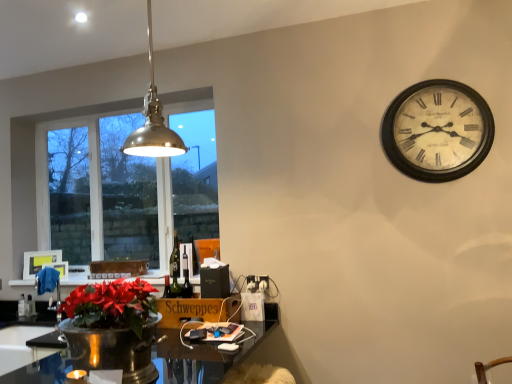
What do you see at coordinates (206, 354) in the screenshot?
I see `shiny black desk at lower center` at bounding box center [206, 354].

In order to face white plastic power outlet at lower center, should I rotate leftwards or rightwards?

Turn right by 0.113 degrees to look at white plastic power outlet at lower center.

What do you see at coordinates (47, 165) in the screenshot? I see `clear glass window at left` at bounding box center [47, 165].

You are a GUI agent. You are given a task and a screenshot of the screen. Output one action in this format:
    pyautogui.click(x=<x>, y=<y>)
    Task: Click on the matte white picture frame at left, the second picture frame in the right-to-left sequence
    
    Given the screenshot: What is the action you would take?
    coord(39,261)

Describe the element at coordinates (437, 131) in the screenshot. This screenshot has height=384, width=512. I see `white painted wood clock at upper right` at that location.

Find the location of `metallic pendant light at upper left`. metallic pendant light at upper left is located at coordinates (153, 120).

Describe the element at coordinates (153, 120) in the screenshot. I see `metallic pendant light at upper left` at that location.

In order to click on shiny black desk at lower center in this screenshot , I will do `click(206, 354)`.

Considering the sizes of objects white painted wood clock at upper right and matte white picture frame at left, placed as the 1th picture frame when sorted from left to right, in the image provided, who is taller, white painted wood clock at upper right or matte white picture frame at left, placed as the 1th picture frame when sorted from left to right,?

With more height is white painted wood clock at upper right.

Is point (389, 118) positioned before point (29, 266)?

Yes.

Which picture frame is the 2nd one when counting from the left side of the white painted wood clock at upper right? Please provide its 2D coordinates.

[(39, 261)]

Considering the relative sizes of white painted wood clock at upper right and matte white picture frame at left, placed as the 1th picture frame when sorted from left to right, in the image provided, is white painted wood clock at upper right smaller than matte white picture frame at left, placed as the 1th picture frame when sorted from left to right,?

Incorrect, white painted wood clock at upper right is not smaller in size than matte white picture frame at left, placed as the 1th picture frame when sorted from left to right.

From a real-world perspective, is shiny black desk at lower center physically located above or below matte white picture frame at left, the second picture frame in the right-to-left sequence?

From a real-world perspective, shiny black desk at lower center is physically below matte white picture frame at left, the second picture frame in the right-to-left sequence.

Is shiny black desk at lower center shorter than matte white picture frame at left, the second picture frame in the right-to-left sequence?

No, shiny black desk at lower center is not shorter than matte white picture frame at left, the second picture frame in the right-to-left sequence.

From the image's perspective, is shiny black desk at lower center under matte white picture frame at left, the second picture frame in the right-to-left sequence?

Correct, shiny black desk at lower center appears lower than matte white picture frame at left, the second picture frame in the right-to-left sequence, in the image.

Which is correct: wooden schweppes at lower center, which ranks as the second cardboard box in left-to-right order, is inside white plastic power outlet at lower center, or outside of it?

wooden schweppes at lower center, which ranks as the second cardboard box in left-to-right order, is spatially situated outside white plastic power outlet at lower center.

Is wooden schweppes at lower center, the 2th cardboard box from the top, wider than white plastic power outlet at lower center?

Yes.

Is wooden schweppes at lower center, arranged as the 1th cardboard box when ordered from the bottom, at the left side of white plastic power outlet at lower center?

Yes.

From the image's perspective, which one is positioned higher, wooden schweppes at lower center, which ranks as the second cardboard box in left-to-right order, or white plastic power outlet at lower center?

white plastic power outlet at lower center, from the image's perspective.

From the image's perspective, relative to clear glass window at left, is shiny black desk at lower center above or below?

Clearly, from the image's perspective, shiny black desk at lower center is below clear glass window at left.

Could you tell me if shiny black desk at lower center is turned towards clear glass window at left?

No, shiny black desk at lower center is not turned towards clear glass window at left.

From a real-world perspective, does shiny black desk at lower center stand above clear glass window at left?

No.

How many degrees apart are the facing directions of shiny black desk at lower center and clear glass window at left?

There is a 90-degree angle between the facing directions of shiny black desk at lower center and clear glass window at left.

Does clear glass window at left have a lesser width compared to brown cardboard box at lower center, the first cardboard box viewed from the left?

Yes.

Which object is more forward, clear glass window at left or brown cardboard box at lower center, which is the second cardboard box from right to left?

Positioned in front is clear glass window at left.

The height and width of the screenshot is (384, 512). Find the location of `window on the left of brown cardboard box at lower center, marked as the second cardboard box in a front-to-back arrangement`. window on the left of brown cardboard box at lower center, marked as the second cardboard box in a front-to-back arrangement is located at coordinates (47, 165).

From a real-world perspective, between clear glass window at left and brown cardboard box at lower center, the 2th cardboard box positioned from the bottom, who is vertically higher?

clear glass window at left is physically above.

Who is taller, metallic pendant light at upper left or matte white picture frame at upper left, positioned as the first picture frame in right-to-left order?

metallic pendant light at upper left is taller.

How much distance is there between metallic pendant light at upper left and matte white picture frame at upper left, positioned as the first picture frame in right-to-left order?

They are 1.60 meters apart.

Is metallic pendant light at upper left with matte white picture frame at upper left, placed as the 2th picture frame when sorted from left to right?

There is a gap between metallic pendant light at upper left and matte white picture frame at upper left, placed as the 2th picture frame when sorted from left to right.

Which point is more distant from viewer, (x=150, y=28) or (x=61, y=272)?

The point (x=61, y=272) is farther.

In the scene shown: Which object is thinner, wooden schweppes at lower center, the 2th cardboard box from the top, or matte white picture frame at left, the second picture frame in the right-to-left sequence?

matte white picture frame at left, the second picture frame in the right-to-left sequence.

From a real-world perspective, is wooden schweppes at lower center, arranged as the 1th cardboard box when ordered from the bottom, under matte white picture frame at left, the second picture frame in the right-to-left sequence?

Yes, from a real-world perspective, wooden schweppes at lower center, arranged as the 1th cardboard box when ordered from the bottom, is beneath matte white picture frame at left, the second picture frame in the right-to-left sequence.

Could you measure the distance between wooden schweppes at lower center, arranged as the 1th cardboard box when ordered from the bottom, and matte white picture frame at left, the second picture frame in the right-to-left sequence?

wooden schweppes at lower center, arranged as the 1th cardboard box when ordered from the bottom, is 1.46 meters from matte white picture frame at left, the second picture frame in the right-to-left sequence.

Would you say wooden schweppes at lower center, arranged as the 1th cardboard box when ordered from the bottom, is outside matte white picture frame at left, the second picture frame in the right-to-left sequence?

Yes, wooden schweppes at lower center, arranged as the 1th cardboard box when ordered from the bottom, is not within matte white picture frame at left, the second picture frame in the right-to-left sequence.

Image resolution: width=512 pixels, height=384 pixels. In order to click on picture frame that is the 2nd object located behind the white painted wood clock at upper right in this screenshot , I will do `click(39, 261)`.

Identify the location of picture frame that is the 2nd one when counting upward from the shiny black desk at lower center (from the image's perspective). The height and width of the screenshot is (384, 512). (39, 261).

Considering their positions, is matte white picture frame at upper left, positioned as the first picture frame in right-to-left order, positioned further to white plastic power outlet at lower center than brown cardboard box at lower center, the first cardboard box viewed from the left?

matte white picture frame at upper left, positioned as the first picture frame in right-to-left order, lies further to white plastic power outlet at lower center than the other object.

Considering their positions, is shiny black desk at lower center positioned further to matte white picture frame at left, the second picture frame in the right-to-left sequence, than clear glass window at left?

The object further to matte white picture frame at left, the second picture frame in the right-to-left sequence, is shiny black desk at lower center.

Considering their positions, is white plastic power outlet at lower center positioned closer to matte white picture frame at left, the second picture frame in the right-to-left sequence, than white painted wood clock at upper right?

white plastic power outlet at lower center is closer to matte white picture frame at left, the second picture frame in the right-to-left sequence.

Estimate the real-world distances between objects in this image. Which object is closer to white plastic power outlet at lower center, matte white picture frame at upper left, positioned as the first picture frame in right-to-left order, or clear glass window at left?

The object closer to white plastic power outlet at lower center is matte white picture frame at upper left, positioned as the first picture frame in right-to-left order.

Estimate the real-world distances between objects in this image. Which object is closer to wooden schweppes at lower center, placed as the first cardboard box when sorted from right to left, matte white picture frame at left, the second picture frame in the right-to-left sequence, or matte white picture frame at upper left, positioned as the first picture frame in right-to-left order?

matte white picture frame at upper left, positioned as the first picture frame in right-to-left order, is positioned closer to the anchor wooden schweppes at lower center, placed as the first cardboard box when sorted from right to left.

Which object lies nearer to the anchor point brown cardboard box at lower center, marked as the second cardboard box in a front-to-back arrangement, white plastic power outlet at lower center or wooden schweppes at lower center, placed as the first cardboard box when sorted from right to left?

The object closer to brown cardboard box at lower center, marked as the second cardboard box in a front-to-back arrangement, is wooden schweppes at lower center, placed as the first cardboard box when sorted from right to left.

Looking at the image, which one is located closer to metallic pendant light at upper left, white painted wood clock at upper right or brown cardboard box at lower center, the 1th cardboard box viewed from the top?

Among the two, brown cardboard box at lower center, the 1th cardboard box viewed from the top, is located nearer to metallic pendant light at upper left.

From the image, which object appears to be nearer to brown cardboard box at lower center, marked as the second cardboard box in a front-to-back arrangement, shiny black desk at lower center or matte white picture frame at left, the second picture frame in the right-to-left sequence?

Among the two, matte white picture frame at left, the second picture frame in the right-to-left sequence, is located nearer to brown cardboard box at lower center, marked as the second cardboard box in a front-to-back arrangement.

Where is `window between shiny black desk at lower center and matte white picture frame at upper left, positioned as the first picture frame in right-to-left order, in the front-back direction`? This screenshot has height=384, width=512. window between shiny black desk at lower center and matte white picture frame at upper left, positioned as the first picture frame in right-to-left order, in the front-back direction is located at coordinates (47, 165).

I want to click on power outlet between shiny black desk at lower center and matte white picture frame at upper left, placed as the 2th picture frame when sorted from left to right, from front to back, so click(257, 283).

Image resolution: width=512 pixels, height=384 pixels. Identify the location of power outlet situated between brown cardboard box at lower center, positioned as the first cardboard box in back-to-front order, and white painted wood clock at upper right from left to right. (257, 283).

I want to click on window located between matte white picture frame at upper left, positioned as the first picture frame in right-to-left order, and white plastic power outlet at lower center in the left-right direction, so click(x=47, y=165).